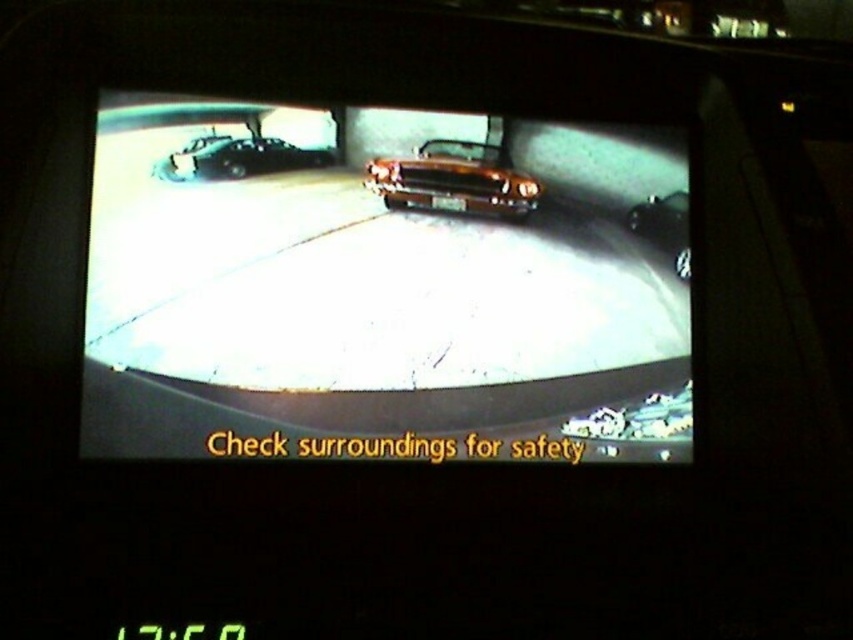
You are a driver preparing to back out of a parking spot. You notice two points marked on your rearview camera display. The first point is at coordinates point [328,257] and the second point is at point [663,212]. Based on the parking scene, which point is closer to your vehicle?

Point [328,257] is in front of point [663,212], so the first point is closer to your vehicle.